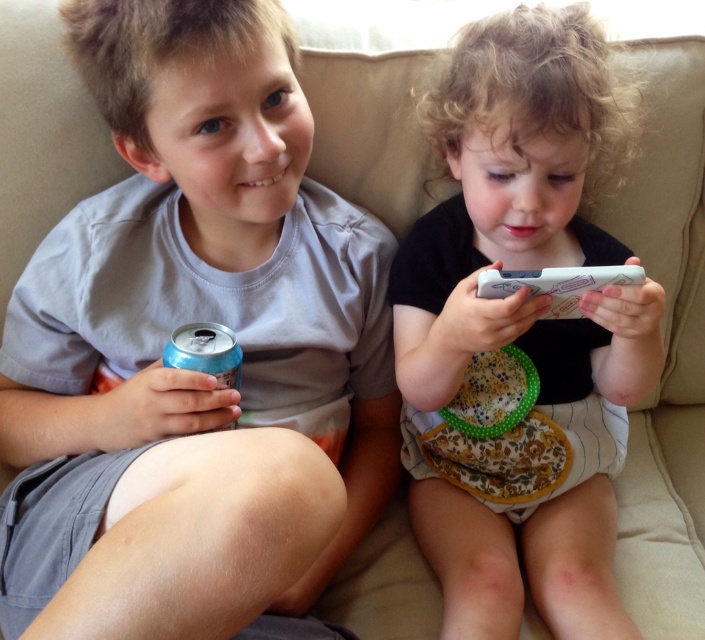
Question: Which point is closer to the camera taking this photo?

Choices:
 (A) (525, 452)
 (B) (99, 90)

Answer: (B)

Question: Can you confirm if matte blue can at left is positioned to the right of blue metallic can at lower left?

Choices:
 (A) yes
 (B) no

Answer: (B)

Question: Which object is farther from the camera taking this photo?

Choices:
 (A) black fabric phone at center
 (B) matte blue can at left
 (C) blue metallic can at lower left

Answer: (C)

Question: Is black fabric phone at center in front of blue metallic can at lower left?

Choices:
 (A) yes
 (B) no

Answer: (A)

Question: Does matte blue can at left appear under black fabric phone at center?

Choices:
 (A) yes
 (B) no

Answer: (A)

Question: Based on their relative distances, which object is farther from the white plastic remote at center?

Choices:
 (A) blue metallic can at lower left
 (B) matte blue can at left
 (C) black fabric phone at center

Answer: (B)